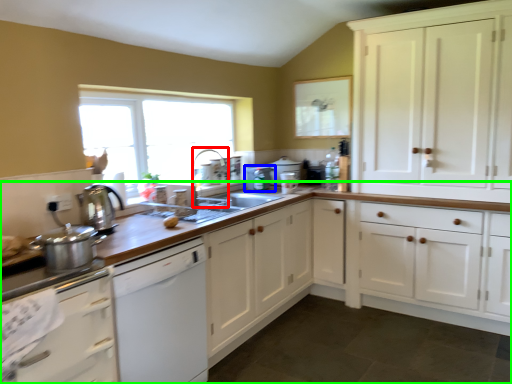
Question: Which is nearer to the faucet (highlighted by a red box)? appliance (highlighted by a blue box) or countertop (highlighted by a green box).

Choices:
 (A) appliance
 (B) countertop

Answer: (A)